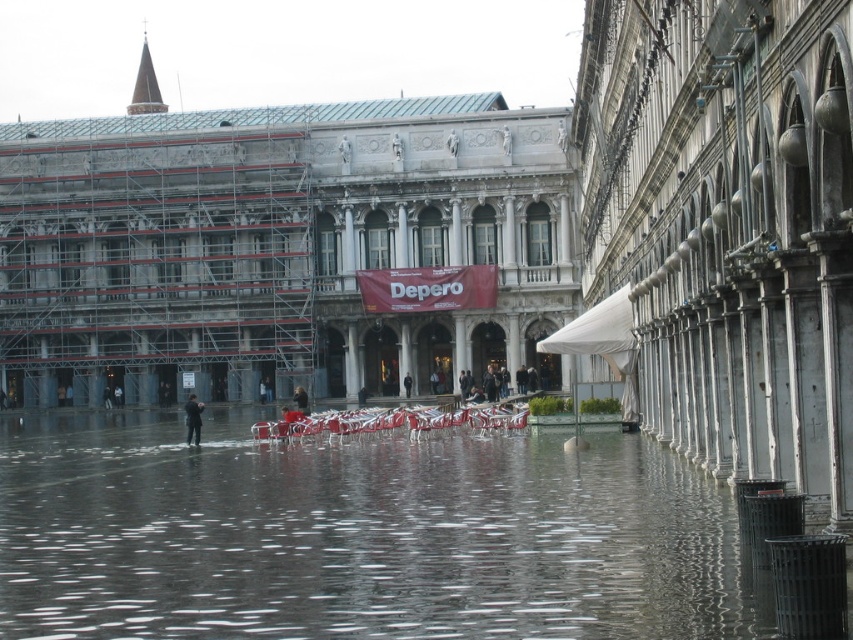
You are standing in the flooded square and want to reach the dry area behind the dark suit at center. Can you walk around the rusty metal columns at right to get there?

The rusty metal columns at right are in front of the dark suit at center, so you can walk around them to reach the dry area behind the dark suit at center.

You are a tourist standing in the flooded square and want to take a photo of both the stone marble palace at center and the rusty metal columns at right. Since the water is covering the ground, you need to stand on higher ground. Which object should you position yourself closer to in order to have both in your camera frame?

The stone marble palace at center is to the left of rusty metal columns at right. To include both in your camera frame while standing on higher ground, position yourself closer to the stone marble palace at center so that the rusty metal columns at right remain within the field of view.

You are a tourist standing in the flooded square and want to reach the entrance of the building on the left. There is a black leather jacket at center and rusty metal columns at right in your path. Which object should you avoid stepping over first to reach the entrance?

You should avoid stepping over the black leather jacket at center first because the rusty metal columns at right are to the right of it, meaning the jacket is closer to your current position when heading towards the building on the left.